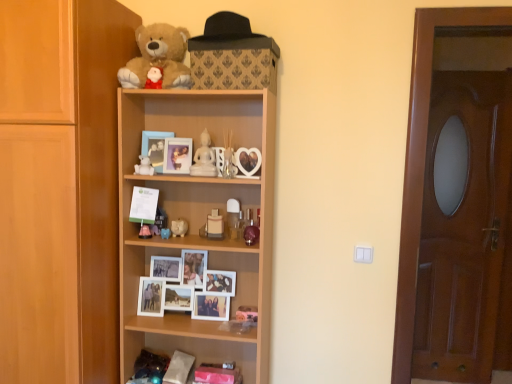
Question: Considering the relative positions of white glossy figurine at upper center and translucent glass vase at center, marked as the fifth toy in a left-to-right arrangement, in the image provided, is white glossy figurine at upper center to the right of translucent glass vase at center, marked as the fifth toy in a left-to-right arrangement, from the viewer's perspective?

Choices:
 (A) no
 (B) yes

Answer: (A)

Question: Can you confirm if white glossy figurine at upper center is bigger than translucent glass vase at center, marked as the fifth toy in a left-to-right arrangement?

Choices:
 (A) yes
 (B) no

Answer: (B)

Question: Considering the relative sizes of white glossy figurine at upper center and translucent glass vase at center, arranged as the first toy when viewed from the right, in the image provided, is white glossy figurine at upper center shorter than translucent glass vase at center, arranged as the first toy when viewed from the right,?

Choices:
 (A) yes
 (B) no

Answer: (A)

Question: Does white glossy figurine at upper center have a lesser width compared to translucent glass vase at center, arranged as the first toy when viewed from the right?

Choices:
 (A) yes
 (B) no

Answer: (A)

Question: Are white glossy figurine at upper center and translucent glass vase at center, marked as the fifth toy in a left-to-right arrangement, beside each other?

Choices:
 (A) yes
 (B) no

Answer: (A)

Question: In terms of height, does brown wooden door at right look taller or shorter compared to white matte bear at upper center, acting as the first toy starting from the left?

Choices:
 (A) short
 (B) tall

Answer: (B)

Question: From the image's perspective, is brown wooden door at right located above or below white matte bear at upper center, the 5th toy from the right?

Choices:
 (A) above
 (B) below

Answer: (B)

Question: Considering their positions, is brown wooden door at right located in front of or behind white matte bear at upper center, the 5th toy from the right?

Choices:
 (A) behind
 (B) front

Answer: (B)

Question: Based on their positions, is brown wooden door at right located to the left or right of white matte bear at upper center, the 5th toy from the right?

Choices:
 (A) right
 (B) left

Answer: (A)

Question: In the image, is white ceramic cat at center, the 4th toy when ordered from left to right, positioned in front of or behind matte white piggy bank at center, arranged as the third toy when viewed from the right?

Choices:
 (A) front
 (B) behind

Answer: (B)

Question: Is point (183, 226) closer or farther from the camera than point (161, 230)?

Choices:
 (A) farther
 (B) closer

Answer: (A)

Question: From the image's perspective, relative to matte white piggy bank at center, arranged as the third toy when viewed from the right, is white ceramic cat at center, arranged as the 2th toy when viewed from the right, above or below?

Choices:
 (A) below
 (B) above

Answer: (B)

Question: Looking at their shapes, would you say white ceramic cat at center, arranged as the 2th toy when viewed from the right, is wider or thinner than matte white piggy bank at center, arranged as the third toy when viewed from the right?

Choices:
 (A) thin
 (B) wide

Answer: (B)

Question: Considering the positions of matte white piggy bank at center, which ranks as the 3th toy in left-to-right order, and white glossy figurine at upper center in the image, is matte white piggy bank at center, which ranks as the 3th toy in left-to-right order, bigger or smaller than white glossy figurine at upper center?

Choices:
 (A) big
 (B) small

Answer: (B)

Question: Which is correct: matte white piggy bank at center, which ranks as the 3th toy in left-to-right order, is inside white glossy figurine at upper center, or outside of it?

Choices:
 (A) inside
 (B) outside

Answer: (B)